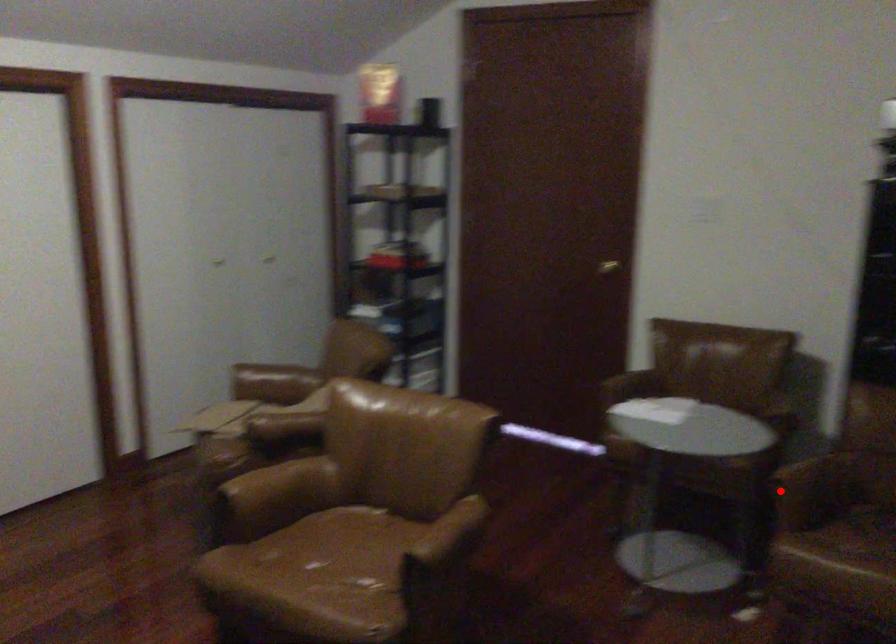
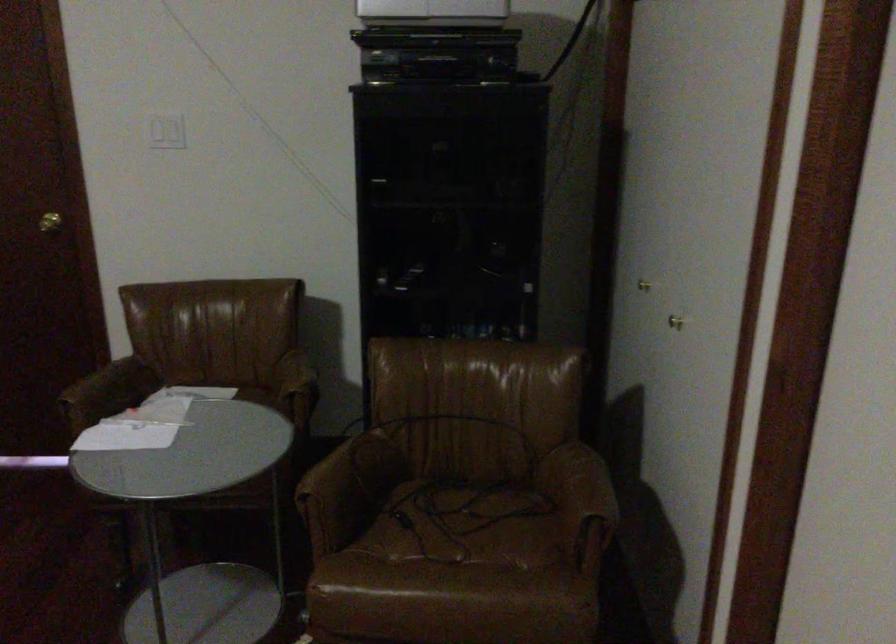
Question: I am providing you with two images of the same scene from different viewpoints. Given a red point in image1, look at the same physical point in image2. Is it:

Choices:
 (A) Closer to the viewpoint
 (B) Farther from the viewpoint

Answer: (A)